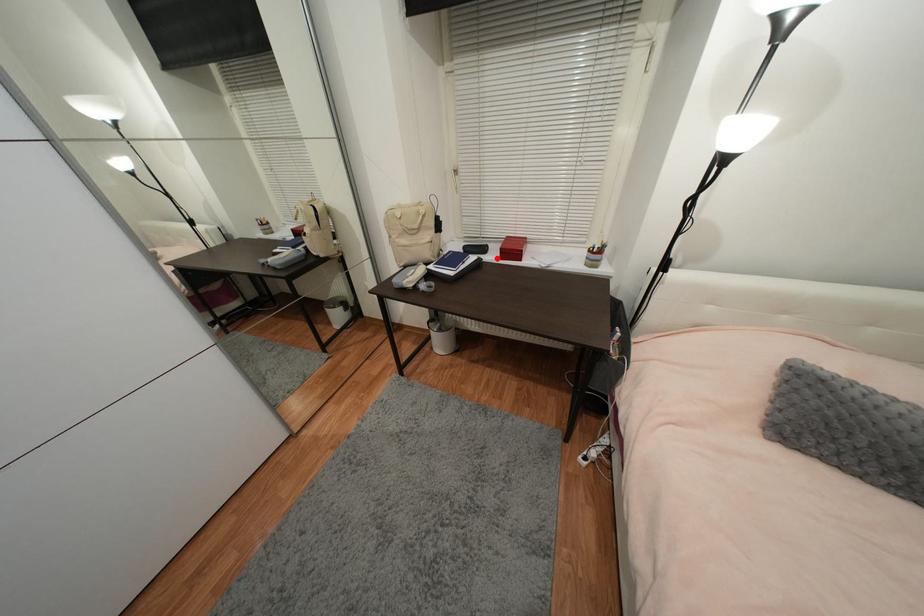
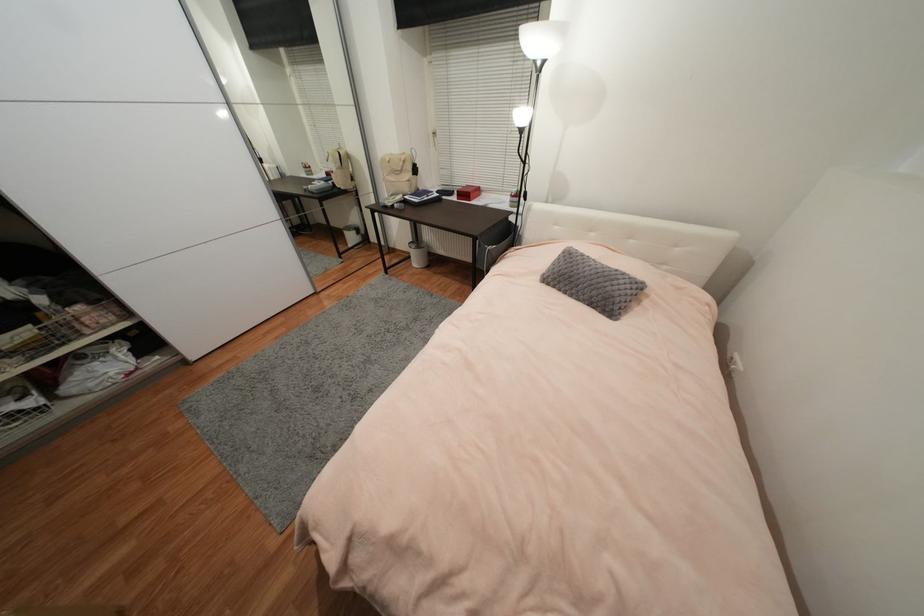
Question: I am providing you with two images of the same scene from different viewpoints. Given a red point in image1, look at the same physical point in image2. Is it:

Choices:
 (A) Closer to the viewpoint
 (B) Farther from the viewpoint

Answer: (A)